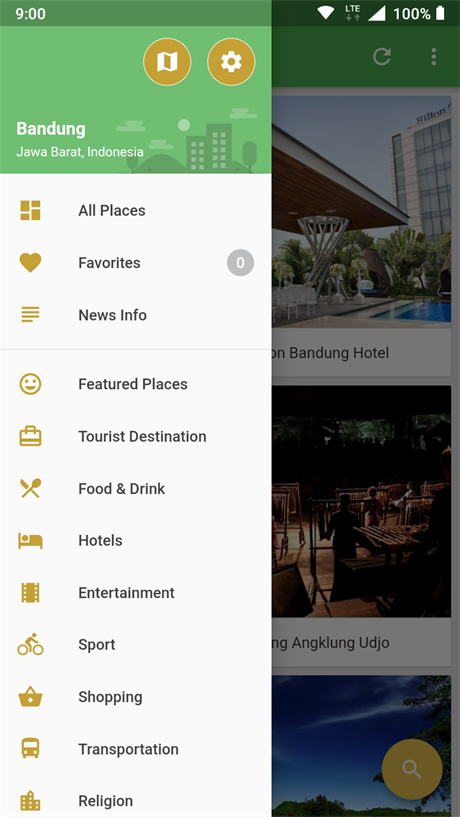
Identify the location of bed icon. (35, 538).